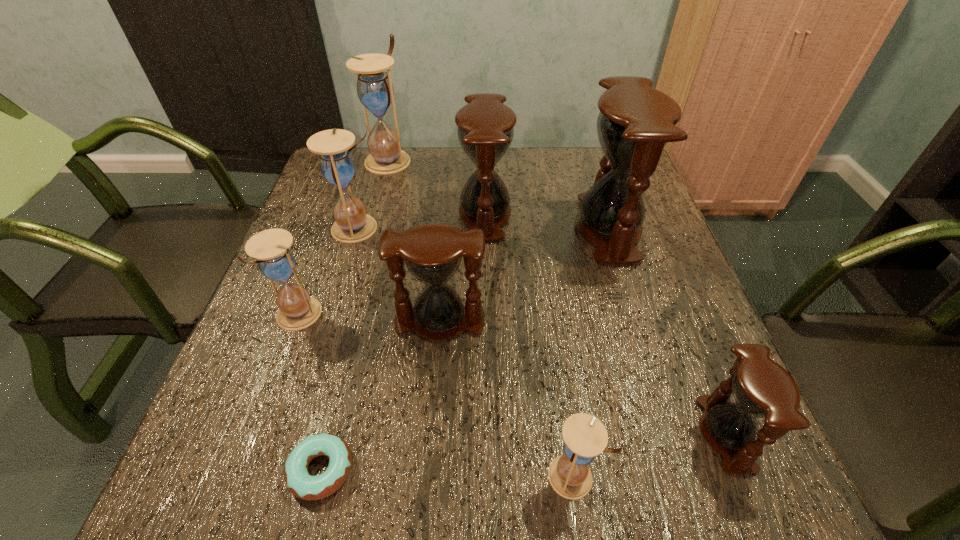
Locate an element on the screen. the farthest white hourglass is located at coordinates (375, 90).

Image resolution: width=960 pixels, height=540 pixels. I want to click on the farthest hourglass, so click(x=375, y=90).

Find the location of a particular element. This screenshot has width=960, height=540. the biggest brown hourglass is located at coordinates pos(635,123).

Where is `the third smallest brown hourglass`? the third smallest brown hourglass is located at coordinates (485, 130).

This screenshot has width=960, height=540. What are the coordinates of `the third smallest white hourglass` in the screenshot? It's located at (337, 165).

Locate an element on the screen. The width and height of the screenshot is (960, 540). the third farthest white hourglass is located at coordinates (297, 310).

Locate an element on the screen. The image size is (960, 540). the third farthest brown hourglass is located at coordinates 432,253.

Identify the location of the nearest brown hourglass. The width and height of the screenshot is (960, 540). (761, 388).

Where is `the smallest white hourglass`? The image size is (960, 540). the smallest white hourglass is located at coordinates (585, 437).

At what (x,y) coordinates should I click in order to perform the action: click on the rightmost white hourglass. Please return your answer as a coordinate pair (x, y). The width and height of the screenshot is (960, 540). Looking at the image, I should click on (585, 437).